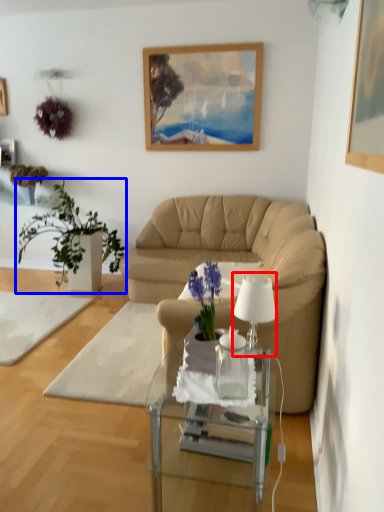
Question: Among these objects, which one is nearest to the camera, lamp (highlighted by a red box) or houseplant (highlighted by a blue box)?

Choices:
 (A) lamp
 (B) houseplant

Answer: (A)